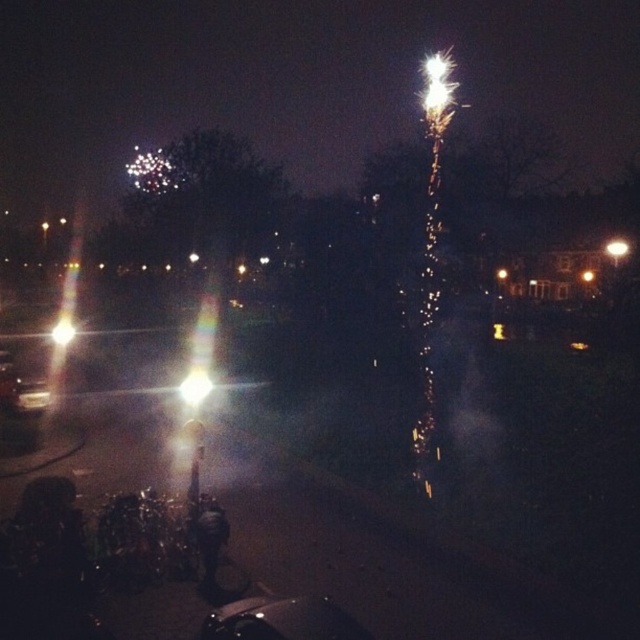
Question: Among these points, which one is nearest to the camera?

Choices:
 (A) (232, 625)
 (B) (612, 246)
 (C) (209, 387)
 (D) (17, 394)

Answer: (A)

Question: Can you confirm if bright white light at center is positioned above bright white light at upper right?

Choices:
 (A) yes
 (B) no

Answer: (B)

Question: Is shiny silver car at left wider than bright metallic streetlight at left?

Choices:
 (A) no
 (B) yes

Answer: (A)

Question: Which object is positioned farthest from the bright white light at upper right?

Choices:
 (A) bright metallic streetlight at left
 (B) bright white light at center

Answer: (A)

Question: Which of the following is the closest to the observer?

Choices:
 (A) bright yellow light at center
 (B) shiny metallic car at center

Answer: (B)

Question: Is bright white light at center below bright metallic streetlight at left?

Choices:
 (A) no
 (B) yes

Answer: (B)